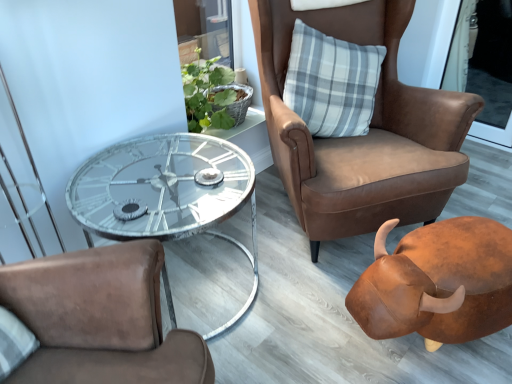
Question: Are gray plaid pillow at upper right and metallic glass coffee table at center far apart?

Choices:
 (A) no
 (B) yes

Answer: (A)

Question: Considering the relative sizes of gray plaid pillow at upper right and metallic glass coffee table at center in the image provided, is gray plaid pillow at upper right smaller than metallic glass coffee table at center?

Choices:
 (A) no
 (B) yes

Answer: (B)

Question: From the image's perspective, is gray plaid pillow at upper right below metallic glass coffee table at center?

Choices:
 (A) yes
 (B) no

Answer: (B)

Question: Considering the relative positions of gray plaid pillow at upper right and metallic glass coffee table at center in the image provided, is gray plaid pillow at upper right to the right of metallic glass coffee table at center from the viewer's perspective?

Choices:
 (A) no
 (B) yes

Answer: (B)

Question: Is gray plaid pillow at upper right not inside metallic glass coffee table at center?

Choices:
 (A) no
 (B) yes

Answer: (B)

Question: Is gray plaid pillow at upper right inside the boundaries of transparent plastic screen door at upper right, or outside?

Choices:
 (A) inside
 (B) outside

Answer: (B)

Question: In the image, is gray plaid pillow at upper right positioned in front of or behind transparent plastic screen door at upper right?

Choices:
 (A) behind
 (B) front

Answer: (B)

Question: Does point (330, 87) appear closer or farther from the camera than point (457, 41)?

Choices:
 (A) farther
 (B) closer

Answer: (B)

Question: Based on their positions, is gray plaid pillow at upper right located to the left or right of transparent plastic screen door at upper right?

Choices:
 (A) right
 (B) left

Answer: (B)

Question: Looking at the image, does metallic glass coffee table at center seem bigger or smaller compared to brown leather piggy bank at lower right?

Choices:
 (A) small
 (B) big

Answer: (B)

Question: Is metallic glass coffee table at center inside the boundaries of brown leather piggy bank at lower right, or outside?

Choices:
 (A) outside
 (B) inside

Answer: (A)

Question: From a real-world perspective, is metallic glass coffee table at center positioned above or below brown leather piggy bank at lower right?

Choices:
 (A) above
 (B) below

Answer: (A)

Question: From the image's perspective, is metallic glass coffee table at center positioned above or below brown leather piggy bank at lower right?

Choices:
 (A) above
 (B) below

Answer: (A)

Question: Does point (475, 102) appear closer or farther from the camera than point (311, 72)?

Choices:
 (A) farther
 (B) closer

Answer: (B)

Question: In terms of height, does brown leather chair at upper right look taller or shorter compared to gray plaid pillow at upper right?

Choices:
 (A) tall
 (B) short

Answer: (A)